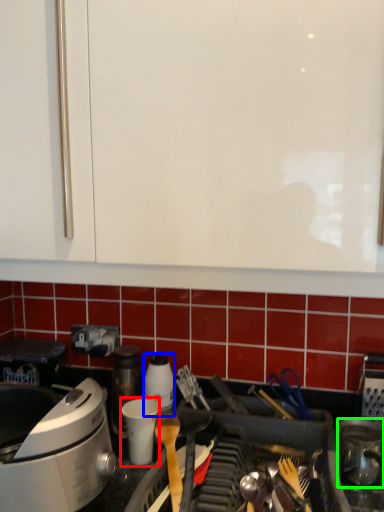
Question: Considering the real-world distances, which object is closest to appliance (highlighted by a red box)? kitchen appliance (highlighted by a blue box) or kitchen appliance (highlighted by a green box).

Choices:
 (A) kitchen appliance
 (B) kitchen appliance

Answer: (A)